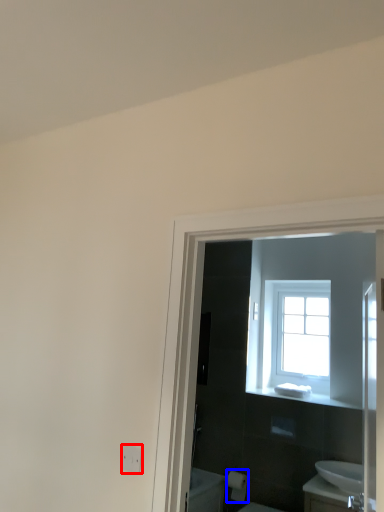
Question: Which object appears farthest to the camera in this image, electric outlet (highlighted by a red box) or toilet paper (highlighted by a blue box)?

Choices:
 (A) electric outlet
 (B) toilet paper

Answer: (B)